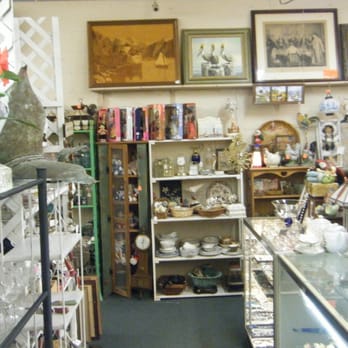
Find the location of a particular element. This screenshot has height=348, width=348. clocks is located at coordinates (136, 243), (179, 159).